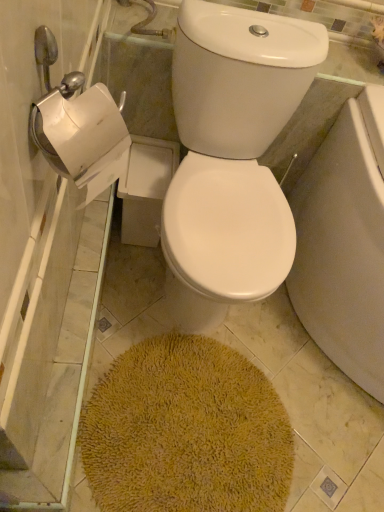
Question: Looking at the image, does white glossy toilet bowl at center seem bigger or smaller compared to yellow shaggy bath mat at center?

Choices:
 (A) small
 (B) big

Answer: (B)

Question: From the image's perspective, is white glossy toilet bowl at center positioned above or below yellow shaggy bath mat at center?

Choices:
 (A) above
 (B) below

Answer: (A)

Question: Is white glossy toilet bowl at center wider or thinner than yellow shaggy bath mat at center?

Choices:
 (A) wide
 (B) thin

Answer: (A)

Question: From the image's perspective, is yellow shaggy bath mat at center located above or below white glossy toilet bowl at center?

Choices:
 (A) below
 (B) above

Answer: (A)

Question: From a real-world perspective, is yellow shaggy bath mat at center physically located above or below white glossy toilet bowl at center?

Choices:
 (A) below
 (B) above

Answer: (A)

Question: Is yellow shaggy bath mat at center situated inside white glossy toilet bowl at center or outside?

Choices:
 (A) inside
 (B) outside

Answer: (B)

Question: Considering the positions of yellow shaggy bath mat at center and white glossy toilet bowl at center in the image, is yellow shaggy bath mat at center bigger or smaller than white glossy toilet bowl at center?

Choices:
 (A) big
 (B) small

Answer: (B)